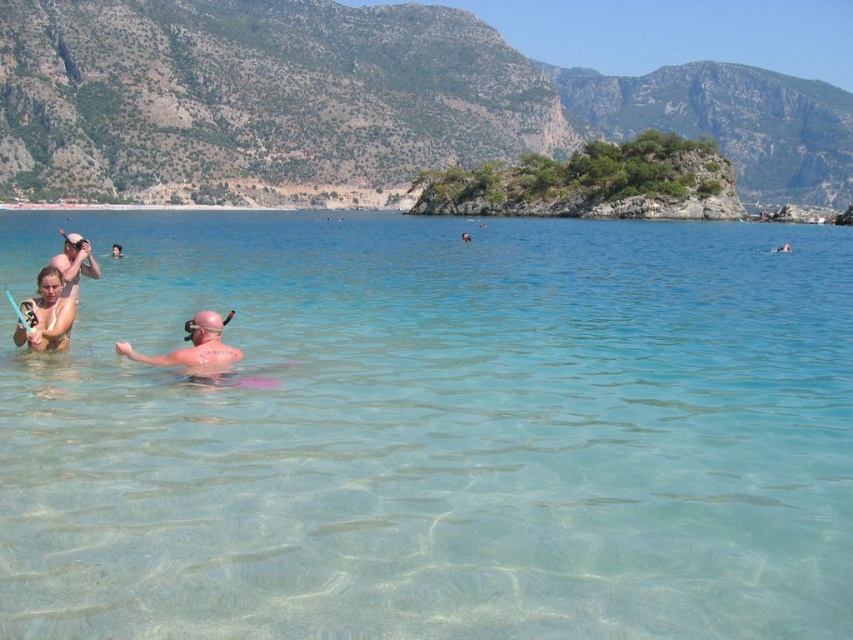
Between matte black bikini at left and matte white swim cap at upper left, which one appears on the left side from the viewer's perspective?

Positioned to the left is matte white swim cap at upper left.

I want to click on matte black bikini at left, so click(56, 298).

Between point (561, 339) and point (86, 253), which one is positioned behind?

Point (86, 253)

Which is more to the right, clear water at center or matte white swim cap at upper left?

clear water at center is more to the right.

Is point (294, 266) less distant than point (86, 260)?

No, it is not.

Locate an element on the screen. The image size is (853, 640). clear water at center is located at coordinates (440, 435).

Is point (672, 467) positioned before point (84, 244)?

Yes, it is in front of point (84, 244).

Consider the image. Between clear water at center and matte black bikini at left, which one has less height?

matte black bikini at left is shorter.

Does point (766, 435) come in front of point (56, 256)?

That is True.

The image size is (853, 640). Identify the location of clear water at center. (440, 435).